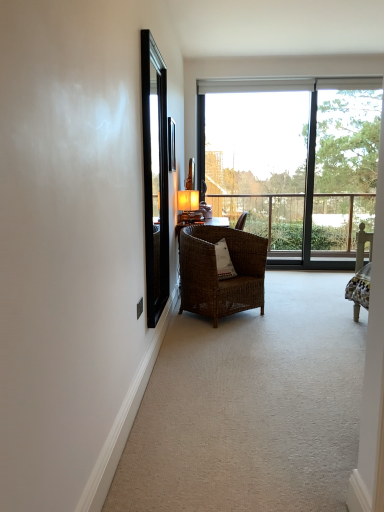
Question: Is woven wicker chair at center directly adjacent to matte gold table lamp at center?

Choices:
 (A) no
 (B) yes

Answer: (A)

Question: From the image's perspective, is woven wicker chair at center on top of matte gold table lamp at center?

Choices:
 (A) yes
 (B) no

Answer: (B)

Question: From a real-world perspective, is woven wicker chair at center on matte gold table lamp at center?

Choices:
 (A) no
 (B) yes

Answer: (A)

Question: Is woven wicker chair at center oriented away from matte gold table lamp at center?

Choices:
 (A) no
 (B) yes

Answer: (A)

Question: Is woven wicker chair at center facing towards matte gold table lamp at center?

Choices:
 (A) no
 (B) yes

Answer: (A)

Question: Is matte gold table lamp at center inside woven wicker chair at center?

Choices:
 (A) yes
 (B) no

Answer: (B)

Question: Is transparent glass window at center turned away from woven wicker chair at center?

Choices:
 (A) yes
 (B) no

Answer: (B)

Question: Is transparent glass window at center closer to camera compared to woven wicker chair at center?

Choices:
 (A) no
 (B) yes

Answer: (A)

Question: Could woven wicker chair at center be considered to be inside transparent glass window at center?

Choices:
 (A) no
 (B) yes

Answer: (A)

Question: Is transparent glass window at center not within woven wicker chair at center?

Choices:
 (A) no
 (B) yes

Answer: (B)

Question: Can you confirm if transparent glass window at center is wider than woven wicker chair at center?

Choices:
 (A) yes
 (B) no

Answer: (B)

Question: Can you confirm if transparent glass window at center is bigger than woven wicker chair at center?

Choices:
 (A) yes
 (B) no

Answer: (A)

Question: Considering the relative positions of matte gold table lamp at center and woven brown chair at center in the image provided, is matte gold table lamp at center in front of woven brown chair at center?

Choices:
 (A) yes
 (B) no

Answer: (B)